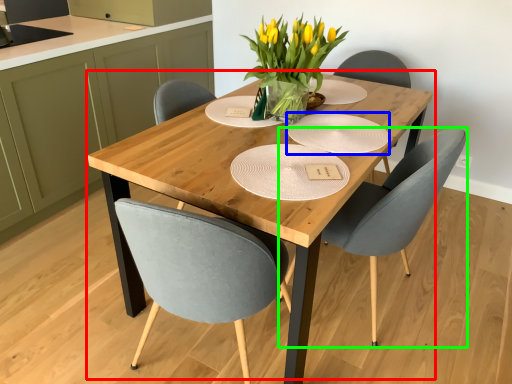
Question: Considering the real-world distances, which object is farthest from kitchen & dining room table (highlighted by a red box)? paper plate (highlighted by a blue box) or chair (highlighted by a green box)?

Choices:
 (A) paper plate
 (B) chair

Answer: (B)